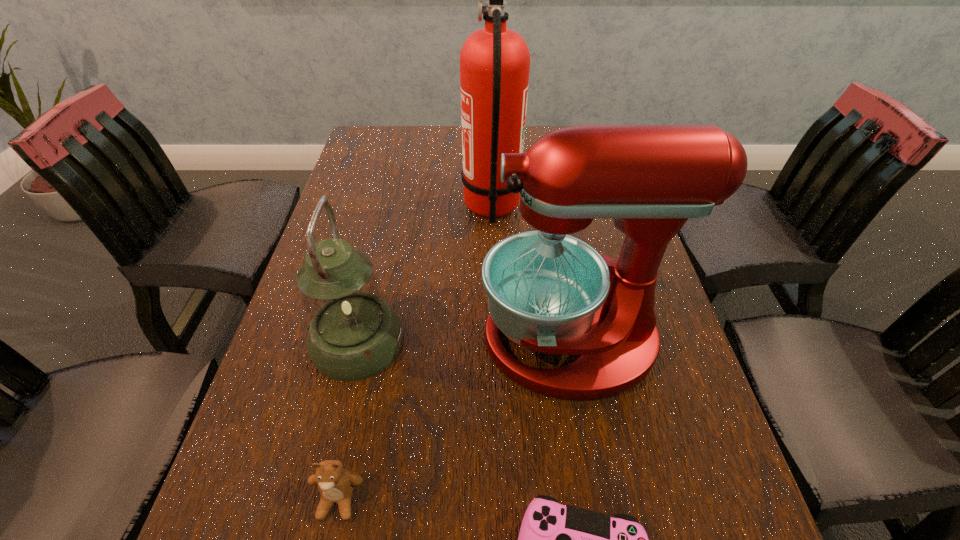
Where is `free space located 0.220m on the front-facing side of the mixer`? This screenshot has width=960, height=540. free space located 0.220m on the front-facing side of the mixer is located at coordinates (370, 340).

Where is `free location located 0.300m on the back of the third tallest object`? free location located 0.300m on the back of the third tallest object is located at coordinates (387, 218).

Where is `lantern located in the left edge section of the desktop`? The width and height of the screenshot is (960, 540). lantern located in the left edge section of the desktop is located at coordinates (353, 334).

Find the location of a particular element. teddy bear that is positioned at the left edge is located at coordinates (335, 484).

You are a GUI agent. You are given a task and a screenshot of the screen. Output one action in this format:
    pyautogui.click(x=<x>, y=<y>)
    Task: Click on the object that is positioned at the right edge
    The height and width of the screenshot is (540, 960).
    Given the screenshot: What is the action you would take?
    pyautogui.click(x=547, y=291)

Find the location of a particular element. vacant region at the far edge of the desktop is located at coordinates (434, 129).

This screenshot has width=960, height=540. What are the coordinates of `vacant space at the left edge` in the screenshot? It's located at tap(382, 256).

Where is `vacant space at the right edge`? Image resolution: width=960 pixels, height=540 pixels. vacant space at the right edge is located at coordinates (705, 519).

I want to click on free region at the far left corner, so click(389, 163).

Where is `free point between the farthest object and the teddy bear`? The height and width of the screenshot is (540, 960). free point between the farthest object and the teddy bear is located at coordinates (415, 354).